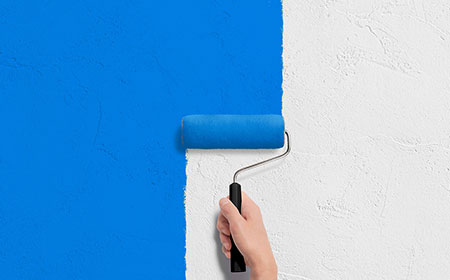
Identify the location of blue paint. The height and width of the screenshot is (280, 450). (152, 80).